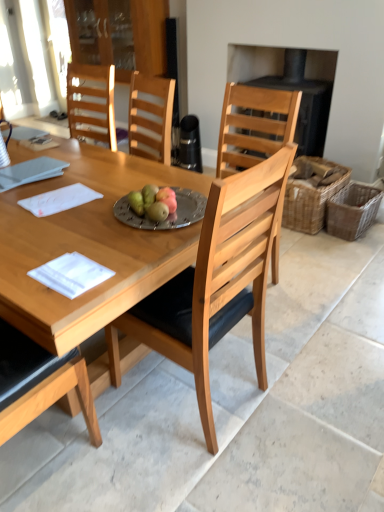
You are a GUI agent. You are given a task and a screenshot of the screen. Output one action in this format:
    pyautogui.click(x=<x>, y=<y>)
    Task: Click on the free space in front of white paper at center, which is counted as the 1th notepad, starting from the front
    This screenshot has width=384, height=512.
    Given the screenshot: What is the action you would take?
    pyautogui.click(x=54, y=305)